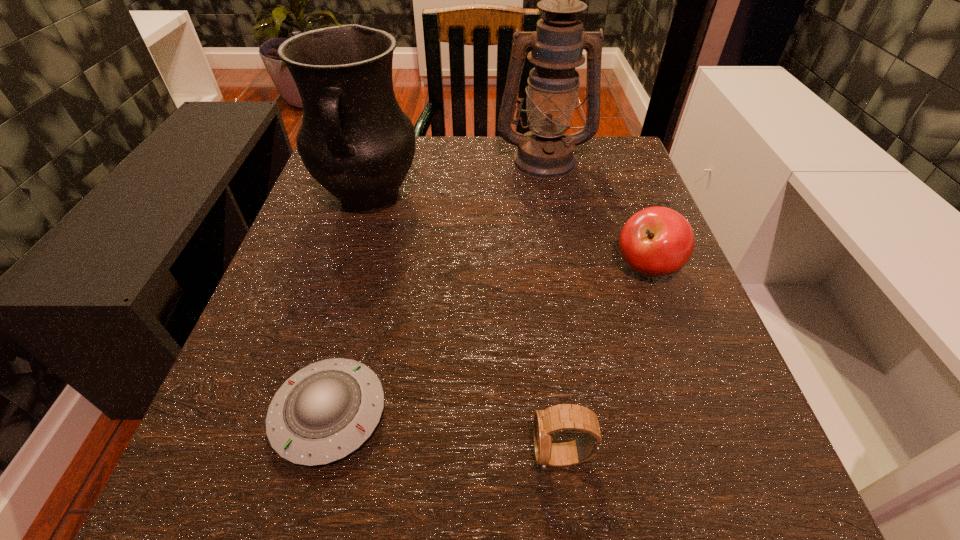
Image resolution: width=960 pixels, height=540 pixels. Find the location of `object positioned at the far left corner`. object positioned at the far left corner is located at coordinates (355, 140).

At what (x,y) coordinates should I click in order to perform the action: click on object present at the near left corner. Please return your answer as a coordinate pair (x, y). Looking at the image, I should click on [325, 411].

You are a GUI agent. You are given a task and a screenshot of the screen. Output one action in this format:
    pyautogui.click(x=<x>, y=<y>)
    Task: Click on the object at the far right corner
    The height and width of the screenshot is (540, 960).
    Given the screenshot: What is the action you would take?
    pyautogui.click(x=545, y=152)

This screenshot has height=540, width=960. In order to click on vacant space at the far edge of the desktop in this screenshot , I will do `click(499, 152)`.

In order to click on vacant region at the near edge of the desktop in this screenshot , I will do `click(618, 496)`.

At what (x,y) coordinates should I click in order to perform the action: click on free space at the left edge. Please return your answer as a coordinate pair (x, y). Looking at the image, I should click on (258, 361).

In the image, there is a desktop. Where is `vacant space at the right edge`? vacant space at the right edge is located at coordinates (612, 214).

Identify the location of free point at the far right corner. This screenshot has width=960, height=540. (591, 180).

The width and height of the screenshot is (960, 540). I want to click on free space between the pitcher and the oil lamp, so click(456, 180).

At what (x,y) coordinates should I click in order to perform the action: click on free space between the pitcher and the shortest object. Please return your answer as a coordinate pair (x, y). Looking at the image, I should click on (349, 306).